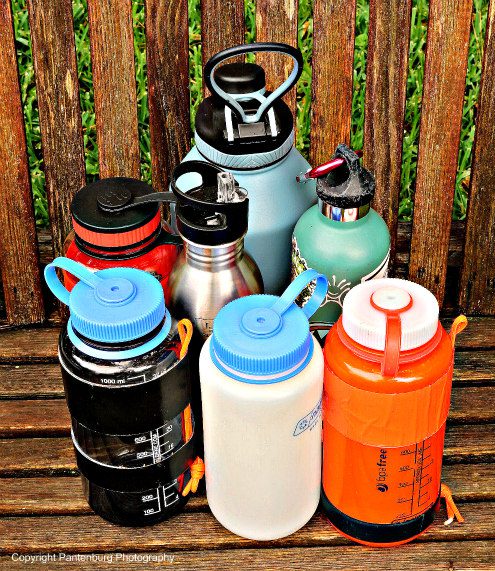
Find the location of a particular element. This screenshot has height=571, width=495. bottles is located at coordinates (376, 376), (265, 408), (117, 333), (343, 237), (216, 241), (142, 243), (274, 151).